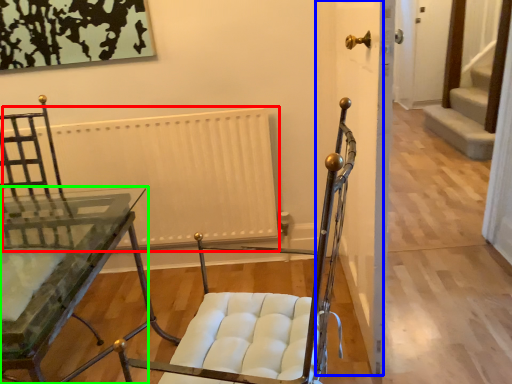
Question: Considering the real-world distances, which object is farthest from radiator (highlighted by a red box)? door (highlighted by a blue box) or table (highlighted by a green box)?

Choices:
 (A) door
 (B) table

Answer: (A)